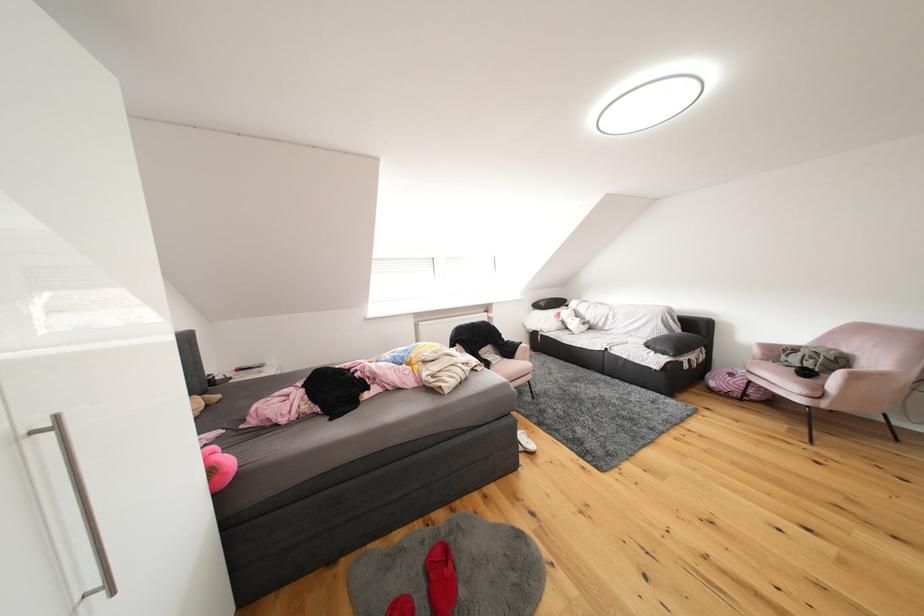
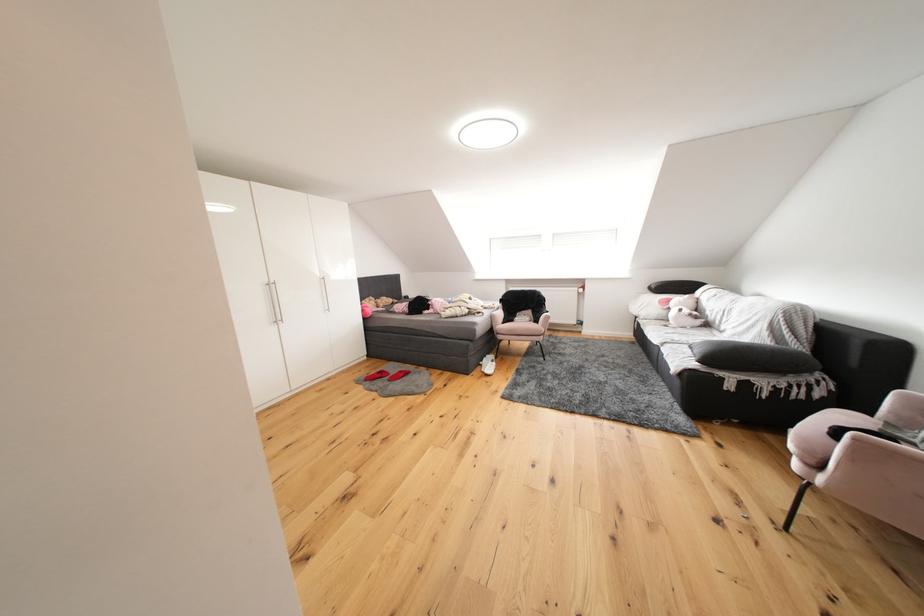
Locate, in the second image, the point that corresponds to the point at 562,333 in the first image.

(660, 321)